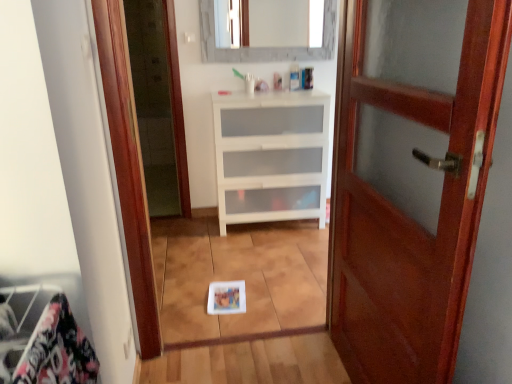
Question: Is white matte chest of drawers at center to the left or to the right of matte gray mirror at upper center in the image?

Choices:
 (A) right
 (B) left

Answer: (A)

Question: Based on their sizes in the image, would you say white matte chest of drawers at center is bigger or smaller than matte gray mirror at upper center?

Choices:
 (A) big
 (B) small

Answer: (A)

Question: Based on their relative distances, which object is farther from the mahogany wood door at right?

Choices:
 (A) matte gray mirror at upper center
 (B) white matte chest of drawers at center

Answer: (A)

Question: Estimate the real-world distances between objects in this image. Which object is closer to the matte gray mirror at upper center?

Choices:
 (A) mahogany wood door at right
 (B) white matte chest of drawers at center

Answer: (B)